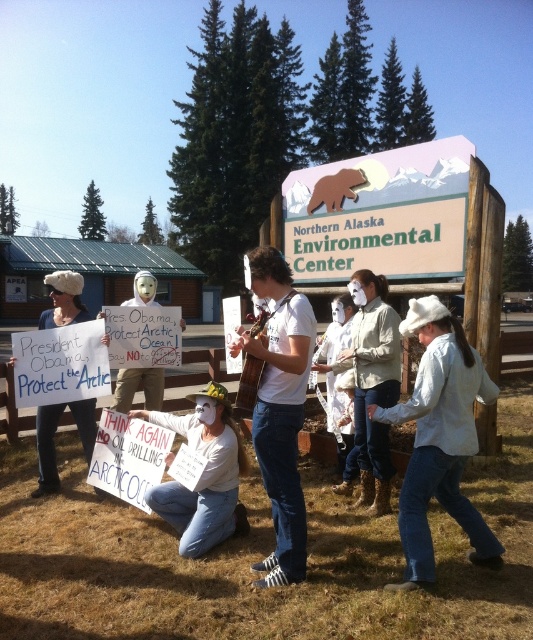
Question: Which point is farther from the camera taking this photo?

Choices:
 (A) click(x=478, y=532)
 (B) click(x=43, y=451)
 (C) click(x=223, y=506)

Answer: (B)

Question: Can you confirm if white denim jeans at lower right is smaller than white fur hat at left?

Choices:
 (A) yes
 (B) no

Answer: (A)

Question: Does white matte mask at center have a smaller size compared to white fur hat at left?

Choices:
 (A) yes
 (B) no

Answer: (A)

Question: Which object is positioned farthest from the white matte mask at center?

Choices:
 (A) white denim jeans at lower right
 (B) white fur hat at left

Answer: (B)

Question: Where is white matte mask at center located in relation to white fur hat at left in the image?

Choices:
 (A) above
 (B) below

Answer: (B)

Question: Which object appears closest to the camera in this image?

Choices:
 (A) white fur hat at left
 (B) white matte mask at center

Answer: (B)